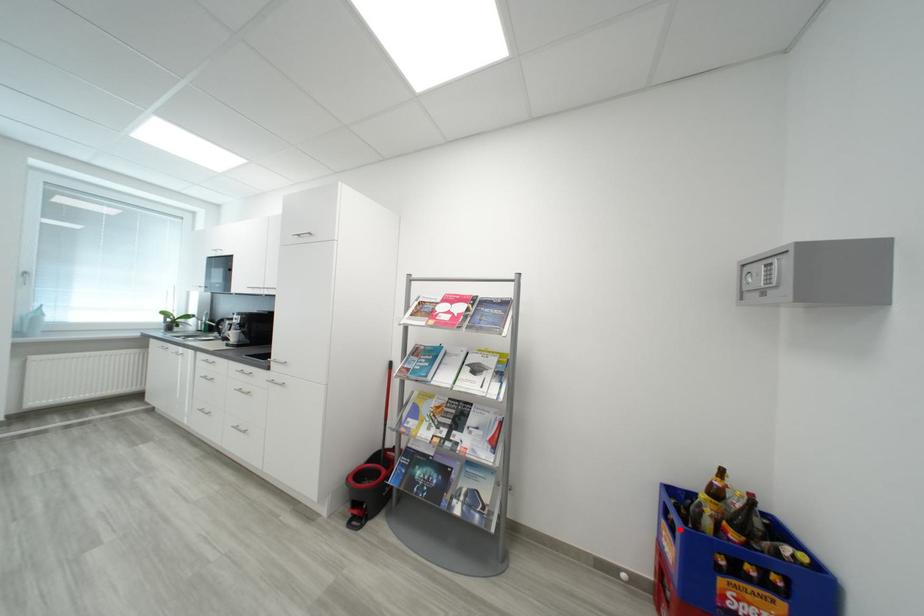
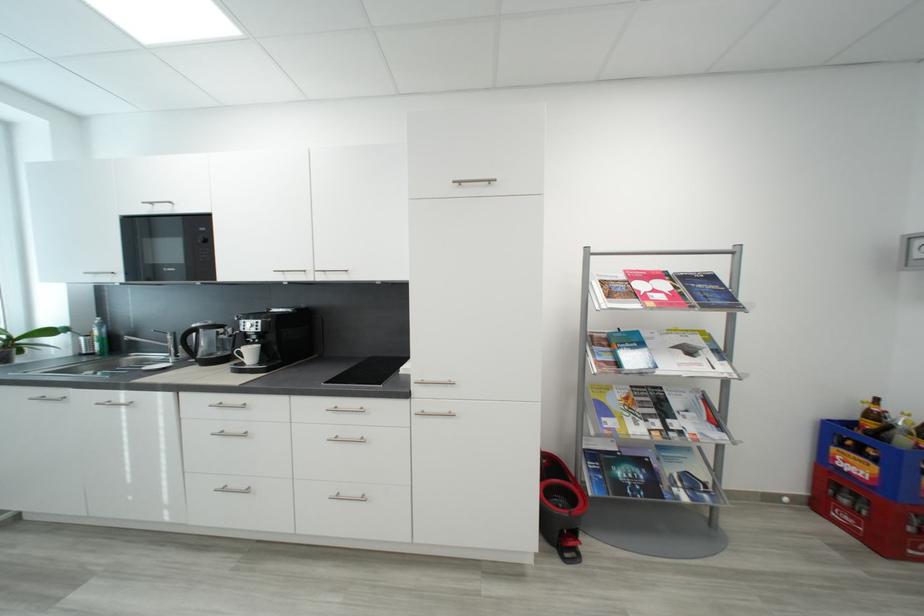
Question: I am providing you with two images of the same scene from different viewpoints. In image1, a red point is highlighted. Considering the same 3D point in image2, which of the following is correct?

Choices:
 (A) It is closer
 (B) It is farther

Answer: (A)